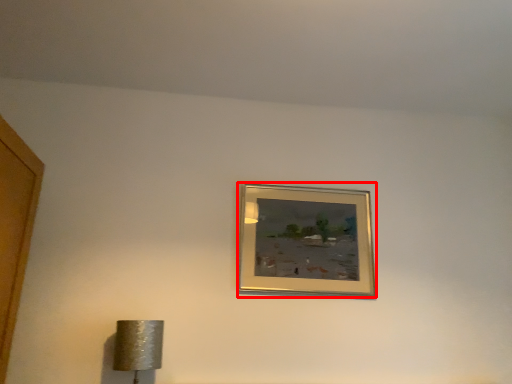
Question: From the image, what is the correct spatial relationship of picture frame (annotated by the red box) in relation to lamp?

Choices:
 (A) left
 (B) right

Answer: (B)